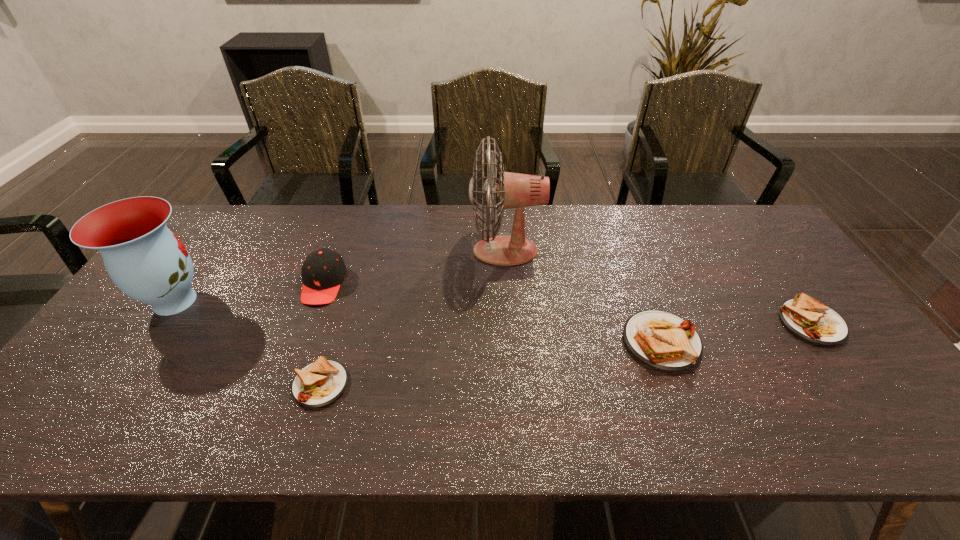
Locate an element on the screen. This screenshot has height=540, width=960. free space that satisfies the following two spatial constraints: 1. on the front-facing side of the cap; 2. on the right side of the second sandwich from right to left is located at coordinates (302, 342).

At what (x,y) coordinates should I click in order to perform the action: click on vacant region that satisfies the following two spatial constraints: 1. in front of the tallest object to direct airflow; 2. on the front side of the leftmost object. Please return your answer as a coordinate pair (x, y). The image size is (960, 540). Looking at the image, I should click on (509, 301).

Where is `vacant region that satisfies the following two spatial constraints: 1. on the front-facing side of the third tallest object; 2. on the left side of the shortest sandwich`? vacant region that satisfies the following two spatial constraints: 1. on the front-facing side of the third tallest object; 2. on the left side of the shortest sandwich is located at coordinates (286, 384).

The width and height of the screenshot is (960, 540). Find the location of `free point that satisfies the following two spatial constraints: 1. on the front side of the tallest sandwich; 2. on the right side of the vase`. free point that satisfies the following two spatial constraints: 1. on the front side of the tallest sandwich; 2. on the right side of the vase is located at coordinates (146, 342).

Identify the location of vacant region that satisfies the following two spatial constraints: 1. in front of the third object from right to left to direct airflow; 2. on the left side of the third shortest object. The image size is (960, 540). (512, 342).

At what (x,y) coordinates should I click in order to perform the action: click on free spot that satisfies the following two spatial constraints: 1. on the front-facing side of the second tallest sandwich; 2. on the right side of the fourth shortest object. Please return your answer as a coordinate pair (x, y). Looking at the image, I should click on (309, 323).

Identify the location of vacant space that satisfies the following two spatial constraints: 1. on the front-facing side of the shortest object; 2. on the right side of the cap. (286, 384).

Where is `free region that satisfies the following two spatial constraints: 1. on the front-facing side of the fifth object from left to right; 2. on the right side of the fourth shortest object`? The image size is (960, 540). free region that satisfies the following two spatial constraints: 1. on the front-facing side of the fifth object from left to right; 2. on the right side of the fourth shortest object is located at coordinates (302, 342).